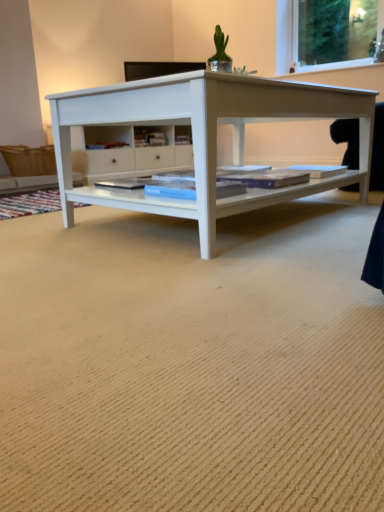
Consider the image. What is the approximate height of white matte coffee table at center?

The height of white matte coffee table at center is 32.75 inches.

Measure the distance between point (360,148) and camera.

Point (360,148) and camera are 7.21 feet apart.

In order to click on white matte coffee table at center in this screenshot , I will do `click(205, 135)`.

The height and width of the screenshot is (512, 384). What do you see at coordinates (205, 135) in the screenshot?
I see `white matte coffee table at center` at bounding box center [205, 135].

You are a GUI agent. You are given a task and a screenshot of the screen. Output one action in this format:
    pyautogui.click(x=<x>, y=<y>)
    Task: Click on the white matte coffee table at center
    The image size is (384, 512).
    Given the screenshot: What is the action you would take?
    pyautogui.click(x=205, y=135)